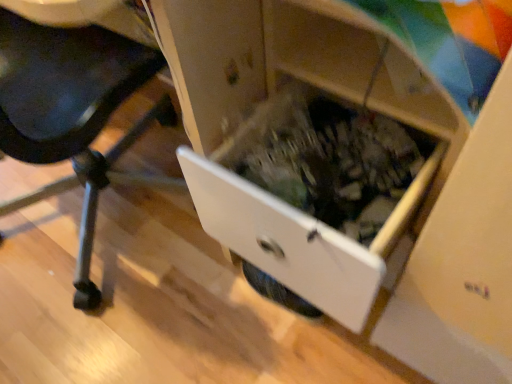
Question: Choose the correct answer: Is white plastic drawer at lower right inside wooden drawer at center or outside it?

Choices:
 (A) outside
 (B) inside

Answer: (A)

Question: Considering the positions of white plastic drawer at lower right and wooden drawer at center in the image, is white plastic drawer at lower right taller or shorter than wooden drawer at center?

Choices:
 (A) short
 (B) tall

Answer: (B)

Question: From the image's perspective, is white plastic drawer at lower right positioned above or below wooden drawer at center?

Choices:
 (A) above
 (B) below

Answer: (A)

Question: Looking at the image, does wooden drawer at center seem bigger or smaller compared to white plastic drawer at lower right?

Choices:
 (A) small
 (B) big

Answer: (A)

Question: Is wooden drawer at center in front of or behind white plastic drawer at lower right in the image?

Choices:
 (A) front
 (B) behind

Answer: (B)

Question: Considering the positions of wooden drawer at center and white plastic drawer at lower right in the image, is wooden drawer at center wider or thinner than white plastic drawer at lower right?

Choices:
 (A) wide
 (B) thin

Answer: (B)

Question: Visually, is wooden drawer at center positioned to the left or to the right of white plastic drawer at lower right?

Choices:
 (A) left
 (B) right

Answer: (B)